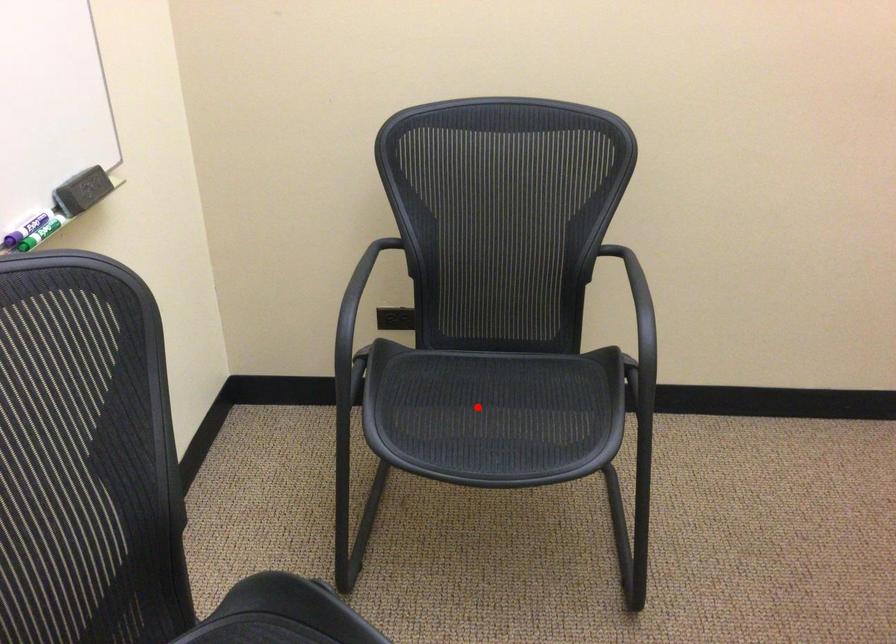
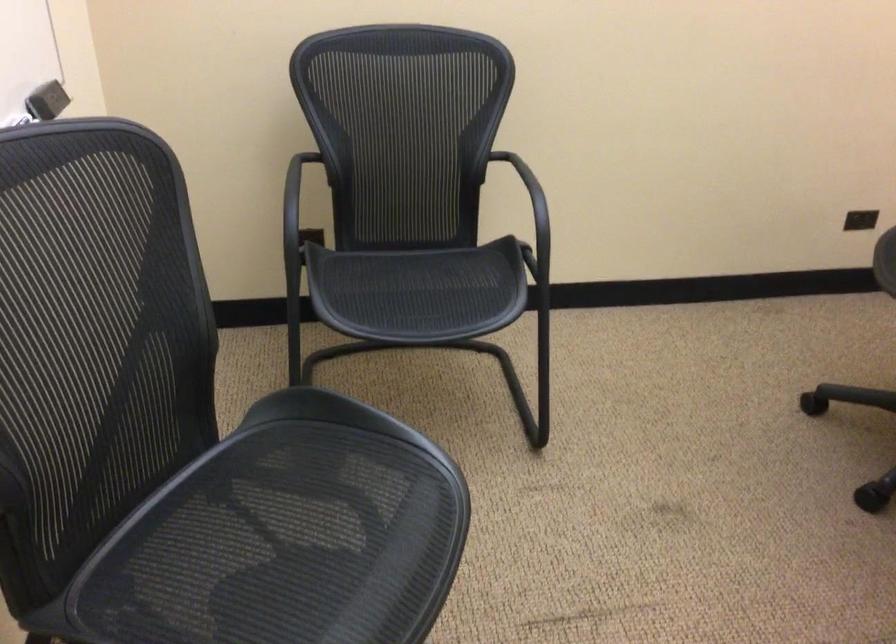
The point at the highlighted location is marked in the first image. Where is the corresponding point in the second image?

(409, 287)